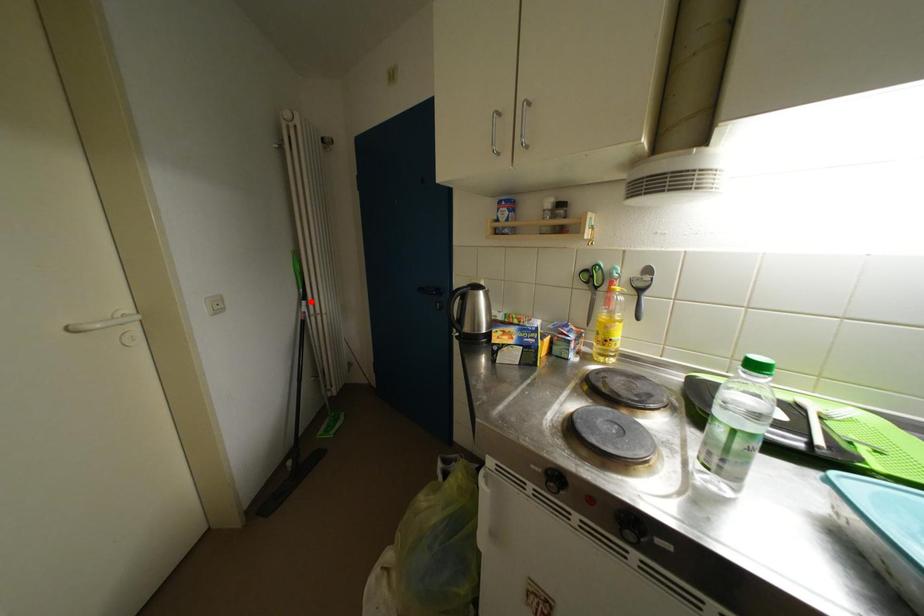
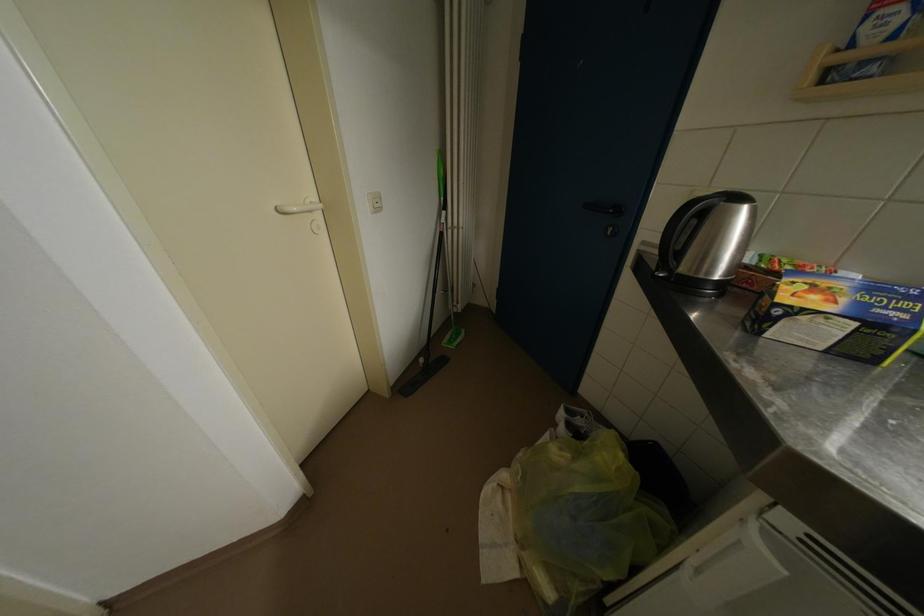
Where in the second image is the point corresponding to the highlighted location from the first image?

(451, 211)